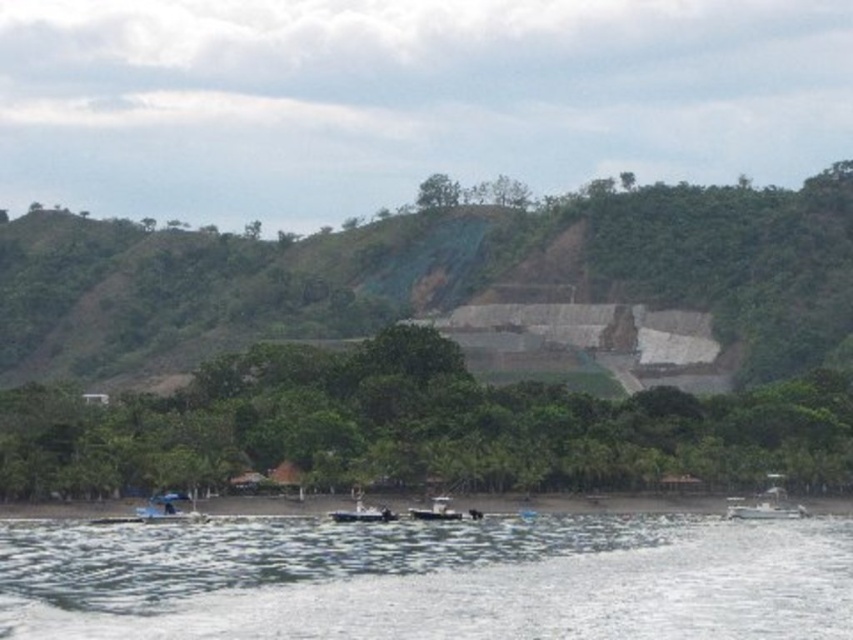
You are standing on the shore looking at the white plastic boat at lower center and the green grassy hillside at center. Which object is positioned to the left of the other?

The green grassy hillside at center is positioned to the left of the white plastic boat at lower center.

You are a photographer planning to capture the entire scene in one shot. Given that the clear water at lower center takes up more space than the metallic gray boat at center, which object would you focus on to ensure both are visible without cropping?

Since the clear water at lower center is bigger than the metallic gray boat at center, focusing on the clear water at lower center would allow both objects to be visible in the frame without cropping.